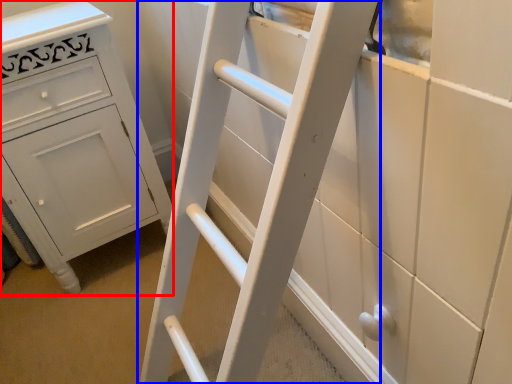
Question: Among these objects, which one is farthest to the camera, chest of drawers (highlighted by a red box) or ladder (highlighted by a blue box)?

Choices:
 (A) chest of drawers
 (B) ladder

Answer: (A)